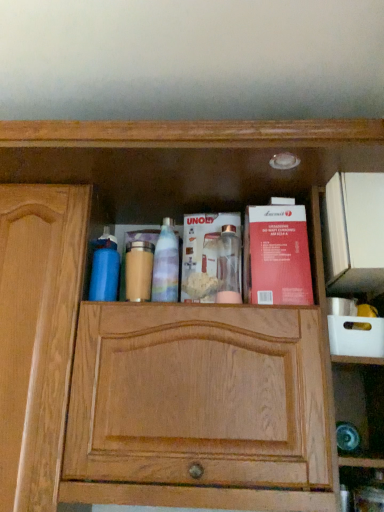
Question: Which direction should I rotate to face metallic silver blender at center, which appears as the first book when viewed from the left, — up or down?

Choices:
 (A) up
 (B) down

Answer: (B)

Question: Is red matte book at center right, acting as the first book starting from the right, wider than blue matte water bottle at left, arranged as the 1th cleaning product when viewed from the left?

Choices:
 (A) yes
 (B) no

Answer: (A)

Question: Is red matte book at center right, arranged as the second book when viewed from the left, in front of blue matte water bottle at left, placed as the 2th cleaning product when sorted from right to left?

Choices:
 (A) yes
 (B) no

Answer: (A)

Question: From the image's perspective, is red matte book at center right, arranged as the second book when viewed from the left, over blue matte water bottle at left, arranged as the 1th cleaning product when viewed from the left?

Choices:
 (A) no
 (B) yes

Answer: (B)

Question: Considering the relative sizes of red matte book at center right, arranged as the second book when viewed from the left, and blue matte water bottle at left, placed as the 2th cleaning product when sorted from right to left, in the image provided, is red matte book at center right, arranged as the second book when viewed from the left, shorter than blue matte water bottle at left, placed as the 2th cleaning product when sorted from right to left,?

Choices:
 (A) yes
 (B) no

Answer: (B)

Question: From the image's perspective, is red matte book at center right, arranged as the second book when viewed from the left, below blue matte water bottle at left, placed as the 2th cleaning product when sorted from right to left?

Choices:
 (A) yes
 (B) no

Answer: (B)

Question: Is blue matte water bottle at left, placed as the 2th cleaning product when sorted from right to left, inside red matte book at center right, acting as the first book starting from the right?

Choices:
 (A) no
 (B) yes

Answer: (A)

Question: Is blue matte water bottle at left, arranged as the 1th cleaning product when viewed from the left, oriented away from matte gold jar at center?

Choices:
 (A) yes
 (B) no

Answer: (B)

Question: Is blue matte water bottle at left, arranged as the 1th cleaning product when viewed from the left, taller than matte gold jar at center?

Choices:
 (A) yes
 (B) no

Answer: (A)

Question: From the image's perspective, does blue matte water bottle at left, arranged as the 1th cleaning product when viewed from the left, appear higher than matte gold jar at center?

Choices:
 (A) yes
 (B) no

Answer: (A)

Question: Does blue matte water bottle at left, arranged as the 1th cleaning product when viewed from the left, touch matte gold jar at center?

Choices:
 (A) yes
 (B) no

Answer: (A)

Question: Can you confirm if blue matte water bottle at left, placed as the 2th cleaning product when sorted from right to left, is thinner than matte gold jar at center?

Choices:
 (A) no
 (B) yes

Answer: (A)

Question: From the image's perspective, is blue matte water bottle at left, placed as the 2th cleaning product when sorted from right to left, located beneath matte gold jar at center?

Choices:
 (A) no
 (B) yes

Answer: (A)

Question: Considering the relative sizes of matte gold jar at center and translucent plastic spray bottle at center, which appears as the 2th cleaning product when viewed from the left, in the image provided, is matte gold jar at center wider than translucent plastic spray bottle at center, which appears as the 2th cleaning product when viewed from the left,?

Choices:
 (A) no
 (B) yes

Answer: (B)